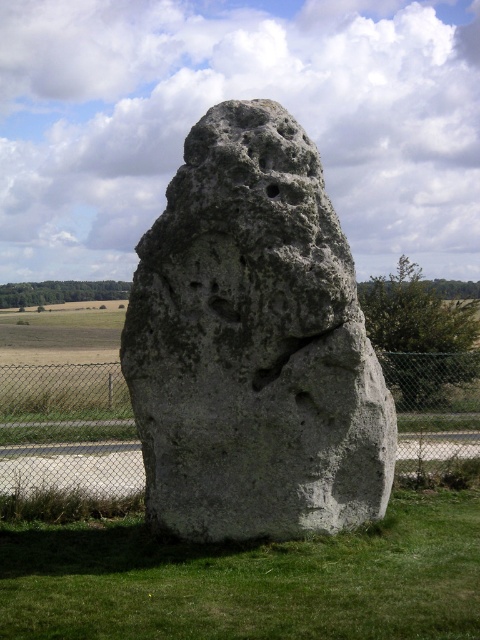
You are standing at the point marked by coordinates (253, 344) in the image. What object are you directly facing?

You are directly facing the gray rough stone at center, as the point (253, 344) represents its location.

You are standing at the point marked by the coordinates point (253,344) in the image. What object are you directly facing?

The point (253,344) indicates the gray rough stone at center, so you are directly facing the gray rough stone at center.